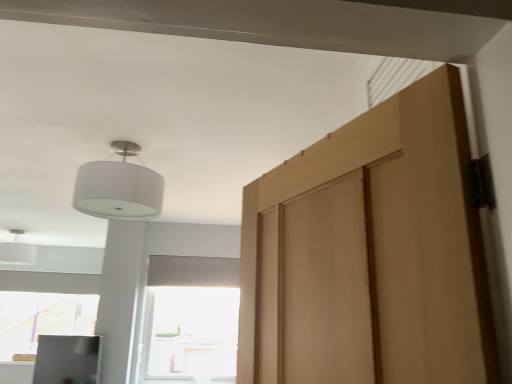
Question: Can you confirm if white matte lampshade at upper left is shorter than transparent glass window at center?

Choices:
 (A) no
 (B) yes

Answer: (B)

Question: From the image's perspective, is white matte lampshade at upper left beneath transparent glass window at center?

Choices:
 (A) yes
 (B) no

Answer: (B)

Question: Is white matte lampshade at upper left at the left side of transparent glass window at center?

Choices:
 (A) yes
 (B) no

Answer: (A)

Question: Are white matte lampshade at upper left and transparent glass window at center far apart?

Choices:
 (A) no
 (B) yes

Answer: (B)

Question: Is white matte lampshade at upper left taller than transparent glass window at center?

Choices:
 (A) yes
 (B) no

Answer: (B)

Question: From their relative heights in the image, would you say transparent glass window at center is taller or shorter than white matte lampshade at upper left?

Choices:
 (A) short
 (B) tall

Answer: (B)

Question: Considering the relative positions of transparent glass window at center and white matte lampshade at upper left in the image provided, is transparent glass window at center to the left or to the right of white matte lampshade at upper left?

Choices:
 (A) left
 (B) right

Answer: (B)

Question: Is transparent glass window at center situated inside white matte lampshade at upper left or outside?

Choices:
 (A) outside
 (B) inside

Answer: (A)

Question: Relative to white matte lampshade at upper left, is transparent glass window at center in front or behind?

Choices:
 (A) behind
 (B) front

Answer: (B)

Question: From the image's perspective, is white matte lampshade at upper left above or below white fabric lampshade at upper left?

Choices:
 (A) above
 (B) below

Answer: (B)

Question: In terms of height, does white matte lampshade at upper left look taller or shorter compared to white fabric lampshade at upper left?

Choices:
 (A) tall
 (B) short

Answer: (B)

Question: Is point (22, 233) positioned closer to the camera than point (121, 203)?

Choices:
 (A) farther
 (B) closer

Answer: (A)

Question: Based on their positions, is white matte lampshade at upper left located to the left or right of white fabric lampshade at upper left?

Choices:
 (A) left
 (B) right

Answer: (A)

Question: From a real-world perspective, is transparent glass window at center physically located above or below white fabric lampshade at upper left?

Choices:
 (A) above
 (B) below

Answer: (B)

Question: Is point (167, 347) positioned closer to the camera than point (121, 208)?

Choices:
 (A) closer
 (B) farther

Answer: (B)